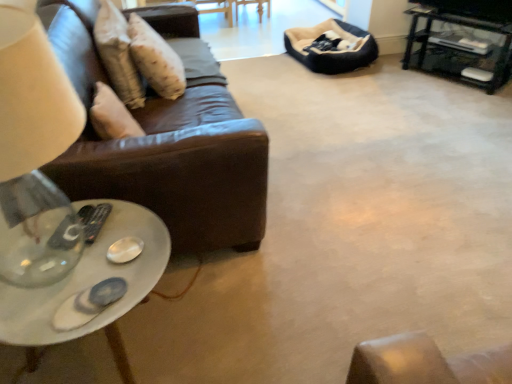
In order to click on space that is in front of black plastic remote at lower left in this screenshot , I will do `click(82, 261)`.